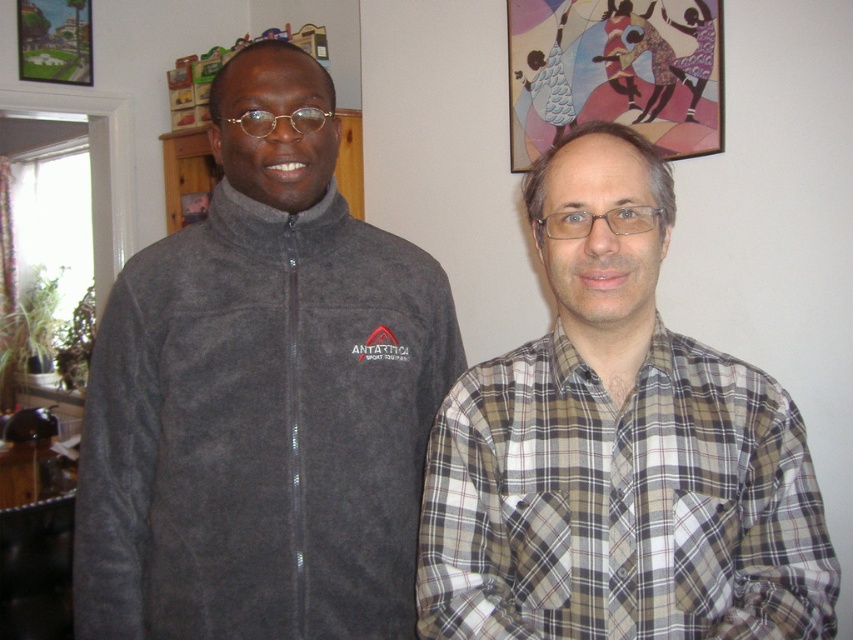
Is the position of dark gray fleece jacket at left less distant than that of plaid fabric shirt at right?

No, it is behind plaid fabric shirt at right.

Is point (294, 209) less distant than point (556, 532)?

No, (294, 209) is further to viewer.

Where is `dark gray fleece jacket at left`? The image size is (853, 640). dark gray fleece jacket at left is located at coordinates (262, 396).